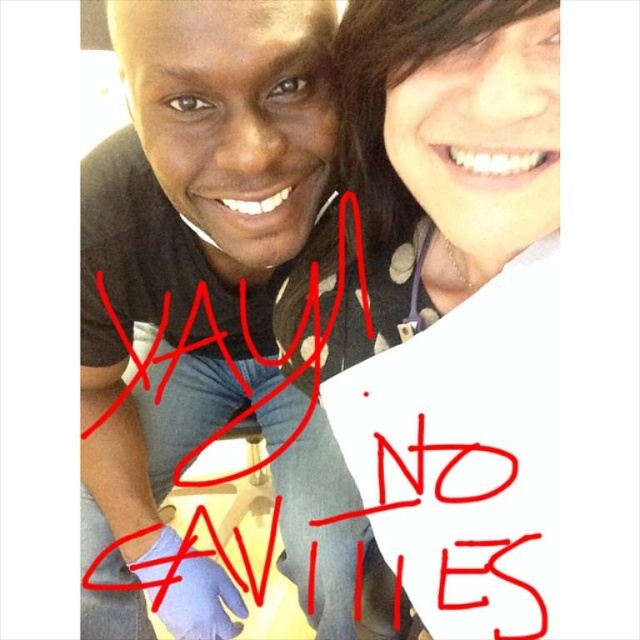
Based on the scene description, which object is positioned higher up in the image, the matte black shirt at upper left or the matte white paper at upper right?

The matte white paper at upper right is positioned higher up because the matte black shirt at upper left is below it.

You are a photographer standing 50 centimeters away from the matte black shirt at upper left. Can you take a clear photo of it without moving closer?

The matte black shirt at upper left and viewer are 49.80 centimeters apart, so yes, you can take a clear photo without moving closer since the distance is just under 50 centimeters.